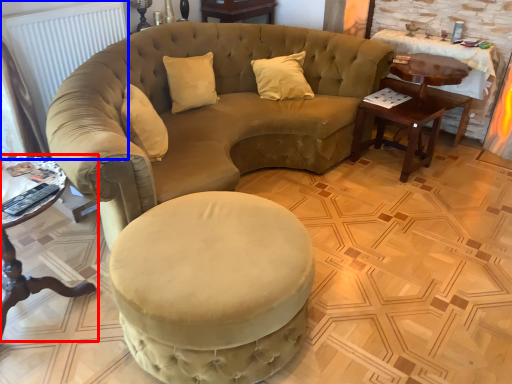
Question: Which object appears farthest to the camera in this image, table (highlighted by a red box) or radiator (highlighted by a blue box)?

Choices:
 (A) table
 (B) radiator

Answer: (B)